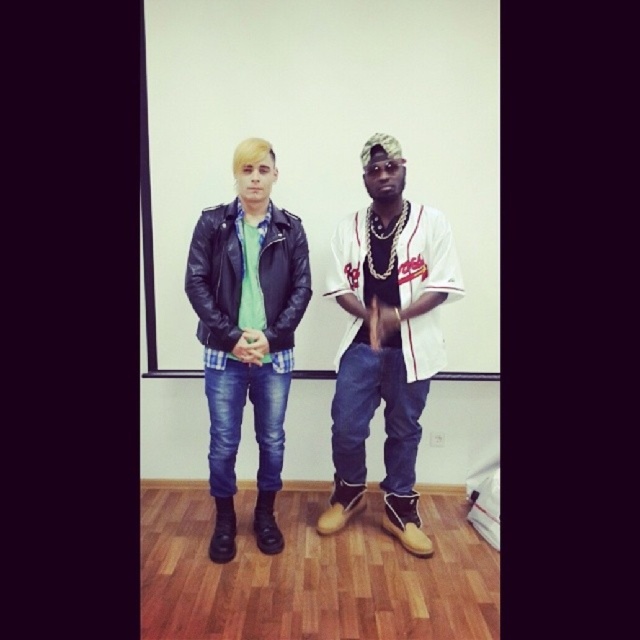
Question: Does matte black leather jacket at center appear on the left side of matte black leather jacket at left?

Choices:
 (A) no
 (B) yes

Answer: (B)

Question: Is matte black leather jacket at center closer to the viewer compared to matte black leather jacket at left?

Choices:
 (A) no
 (B) yes

Answer: (B)

Question: Does leather jacket at center appear under matte black leather jacket at left?

Choices:
 (A) yes
 (B) no

Answer: (A)

Question: Which object is positioned closest to the leather jacket at center?

Choices:
 (A) matte black leather jacket at left
 (B) matte black leather jacket at center

Answer: (B)

Question: Estimate the real-world distances between objects in this image. Which object is closer to the matte black leather jacket at left?

Choices:
 (A) matte black leather jacket at center
 (B) leather jacket at center

Answer: (A)

Question: Which object appears farthest from the camera in this image?

Choices:
 (A) leather jacket at center
 (B) matte black leather jacket at left
 (C) matte black leather jacket at center

Answer: (B)